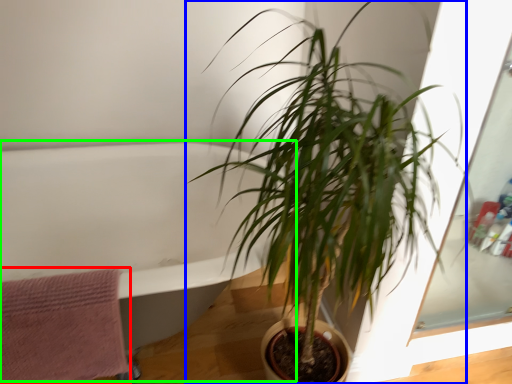
Question: Estimate the real-world distances between objects in this image. Which object is closer to bath towel (highlighted by a red box), houseplant (highlighted by a blue box) or bath (highlighted by a green box)?

Choices:
 (A) houseplant
 (B) bath

Answer: (B)